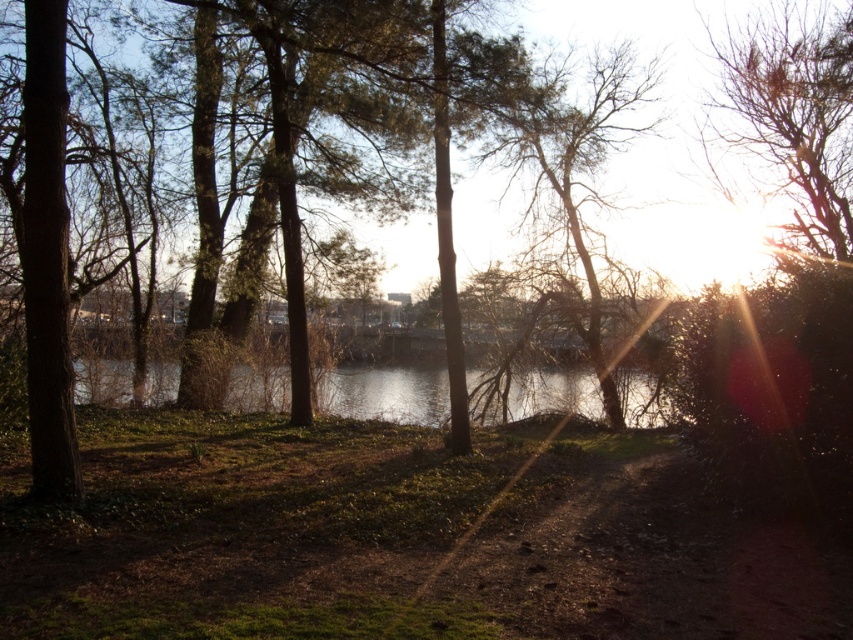
You are a hiker carrying a 2.5 meter long fishing rod. You want to place the rod horizontally between the bare branches at upper center and the clear water at center. Is there enough space for the rod to fit without bending it?

The distance between the bare branches at upper center and the clear water at center is 5.90 meters. Since the rod is 2.5 meters long, there is sufficient space to place it horizontally without bending.

You are standing on the dirt path and looking towards the water. Which direction should you turn to see the bare branches at upper right first before the bare branches at upper center?

You should turn to the right because the bare branches at upper right is located to the right of the bare branches at upper center.

You are an artist sketching the scene and want to highlight the contrast between the two sets of bare branches. Which of the two, the bare branches at upper right or the bare branches at upper center, should you draw with finer lines to emphasize their difference?

The bare branches at upper right should be drawn with finer lines because they are thinner than the bare branches at upper center.